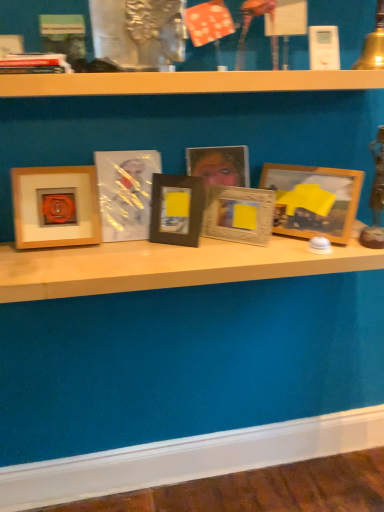
Question: From a real-world perspective, is matte wood picture frame at left, marked as the first picture frame in a left-to-right arrangement, under wooden shelf at center?

Choices:
 (A) no
 (B) yes

Answer: (A)

Question: Is matte wood picture frame at left, marked as the first picture frame in a left-to-right arrangement, outside of wooden shelf at center?

Choices:
 (A) yes
 (B) no

Answer: (A)

Question: Is matte wood picture frame at left, marked as the first picture frame in a left-to-right arrangement, surrounding wooden shelf at center?

Choices:
 (A) no
 (B) yes

Answer: (A)

Question: Is the position of matte wood picture frame at left, marked as the first picture frame in a left-to-right arrangement, less distant than that of wooden shelf at center?

Choices:
 (A) no
 (B) yes

Answer: (A)

Question: Is matte wood picture frame at left, the sixth picture frame when ordered from right to left, wider than wooden shelf at center?

Choices:
 (A) yes
 (B) no

Answer: (B)

Question: From a real-world perspective, is matte wood picture frame at left, the sixth picture frame when ordered from right to left, over wooden shelf at center?

Choices:
 (A) yes
 (B) no

Answer: (A)

Question: Can wooden shelf at center be found inside black matte picture frame at center, which ranks as the third picture frame in left-to-right order?

Choices:
 (A) no
 (B) yes

Answer: (A)

Question: Can you confirm if black matte picture frame at center, which is the 4th picture frame in right-to-left order, is smaller than wooden shelf at center?

Choices:
 (A) yes
 (B) no

Answer: (A)

Question: Considering the relative sizes of black matte picture frame at center, which is the 4th picture frame in right-to-left order, and wooden shelf at center in the image provided, is black matte picture frame at center, which is the 4th picture frame in right-to-left order, bigger than wooden shelf at center?

Choices:
 (A) yes
 (B) no

Answer: (B)

Question: Is black matte picture frame at center, which ranks as the third picture frame in left-to-right order, not near wooden shelf at center?

Choices:
 (A) no
 (B) yes

Answer: (A)

Question: Would you say black matte picture frame at center, which ranks as the third picture frame in left-to-right order, is outside wooden shelf at center?

Choices:
 (A) no
 (B) yes

Answer: (B)

Question: Is black matte picture frame at center, which is the 4th picture frame in right-to-left order, wider than wooden shelf at center?

Choices:
 (A) no
 (B) yes

Answer: (A)

Question: Does wooden photo frame at center, the 3th picture frame in the right-to-left sequence, have a larger size compared to matte plastic picture frame at center, marked as the 2th picture frame in a left-to-right arrangement?

Choices:
 (A) yes
 (B) no

Answer: (A)